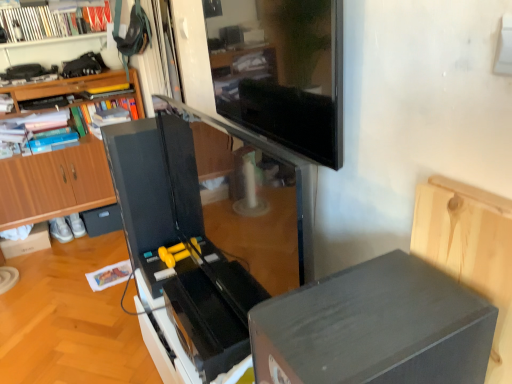
Question: Is matte black tv at upper center oriented towards matte black drawer at lower left?

Choices:
 (A) no
 (B) yes

Answer: (A)

Question: Considering the relative positions of matte black tv at upper center and matte black drawer at lower left in the image provided, is matte black tv at upper center to the right of matte black drawer at lower left from the viewer's perspective?

Choices:
 (A) no
 (B) yes

Answer: (B)

Question: From a real-world perspective, does matte black tv at upper center sit lower than matte black drawer at lower left?

Choices:
 (A) yes
 (B) no

Answer: (B)

Question: Is matte black tv at upper center smaller than matte black drawer at lower left?

Choices:
 (A) no
 (B) yes

Answer: (B)

Question: Is matte black tv at upper center not close to matte black drawer at lower left?

Choices:
 (A) no
 (B) yes

Answer: (B)

Question: Is point (46, 8) positioned closer to the camera than point (217, 369)?

Choices:
 (A) farther
 (B) closer

Answer: (A)

Question: From the image's perspective, is white glossy bookshelf at upper left above or below matte black treadmill at center?

Choices:
 (A) below
 (B) above

Answer: (B)

Question: Is white glossy bookshelf at upper left in front of or behind matte black treadmill at center in the image?

Choices:
 (A) front
 (B) behind

Answer: (B)

Question: Considering the relative positions of white glossy bookshelf at upper left and matte black treadmill at center in the image provided, is white glossy bookshelf at upper left to the left or to the right of matte black treadmill at center?

Choices:
 (A) left
 (B) right

Answer: (A)

Question: From a real-world perspective, is wooden bookcase at left above or below matte black drawer at lower left?

Choices:
 (A) above
 (B) below

Answer: (A)

Question: Considering the positions of wooden bookcase at left and matte black drawer at lower left in the image, is wooden bookcase at left taller or shorter than matte black drawer at lower left?

Choices:
 (A) tall
 (B) short

Answer: (A)

Question: Considering their positions, is wooden bookcase at left located in front of or behind matte black drawer at lower left?

Choices:
 (A) behind
 (B) front

Answer: (B)

Question: Based on their positions, is wooden bookcase at left located to the left or right of matte black drawer at lower left?

Choices:
 (A) right
 (B) left

Answer: (B)

Question: Choose the correct answer: Is white glossy bookshelf at upper left inside matte black drawer at lower left or outside it?

Choices:
 (A) inside
 (B) outside

Answer: (B)

Question: Is point (24, 34) positioned closer to the camera than point (105, 230)?

Choices:
 (A) closer
 (B) farther

Answer: (A)